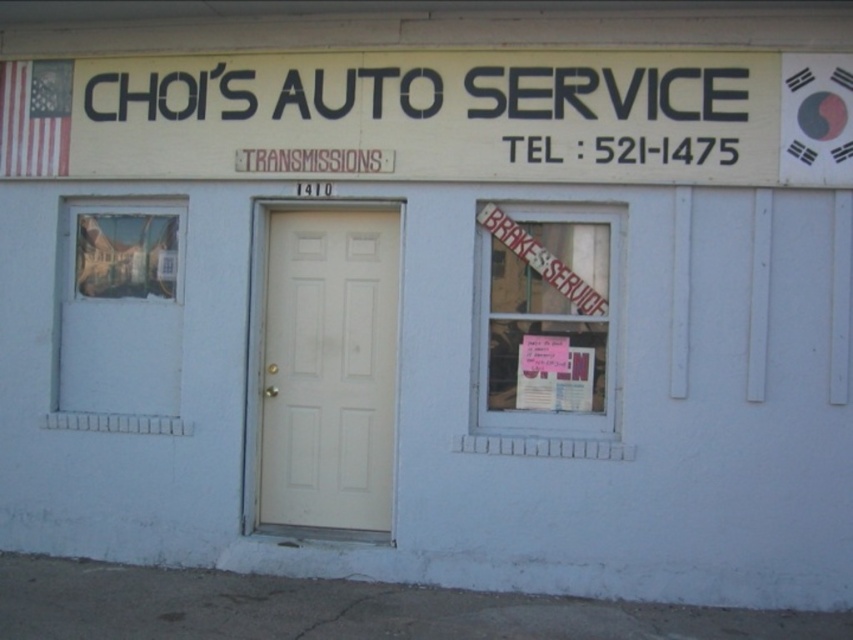
Measure the distance between point (x=288, y=278) and camera.

Point (x=288, y=278) and camera are 6.72 meters apart.

Which is more to the right, matte white door at center or transparent glass window at left?

From the viewer's perspective, matte white door at center appears more on the right side.

Measure the distance between point (277, 516) and camera.

Point (277, 516) is 6.71 meters from camera.

Find the location of a particular element. This screenshot has width=853, height=640. matte white door at center is located at coordinates (328, 369).

Does black plastic sign at upper center appear over matte white door at center?

Indeed, black plastic sign at upper center is positioned over matte white door at center.

Does point (550, 156) come behind point (310, 476)?

No, (550, 156) is closer to viewer.

This screenshot has height=640, width=853. I want to click on black plastic sign at upper center, so click(422, 116).

Does clear glass window at center right have a greater height compared to transparent glass window at left?

Incorrect, clear glass window at center right's height is not larger of transparent glass window at left's.

Can you confirm if clear glass window at center right is wider than transparent glass window at left?

In fact, clear glass window at center right might be narrower than transparent glass window at left.

Measure the distance between point (492, 323) and camera.

They are 6.39 meters apart.

Identify the location of clear glass window at center right. Image resolution: width=853 pixels, height=640 pixels. (548, 320).